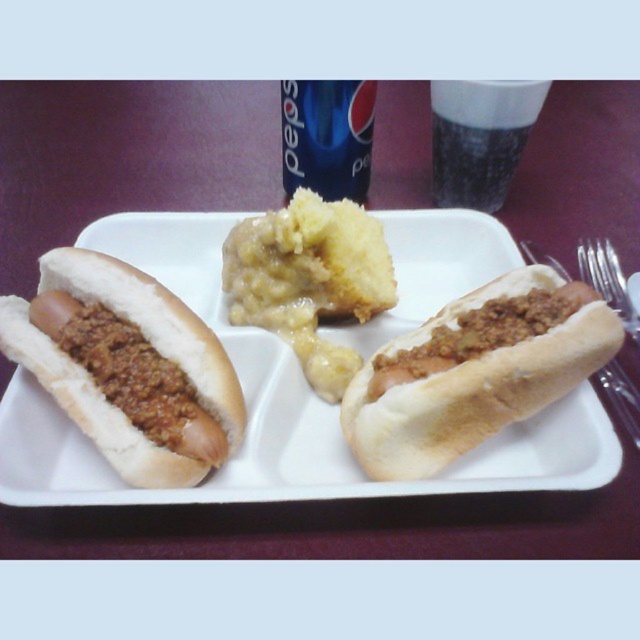
Can you confirm if white matte tray at center is positioned to the right of black glass at upper center?

No, white matte tray at center is not to the right of black glass at upper center.

Between point (349, 326) and point (472, 106), which one is positioned in front?

Point (349, 326) is in front.

Does point (138, 246) lie in front of point (500, 99)?

No, (138, 246) is further to viewer.

Locate an element on the screen. white matte tray at center is located at coordinates (269, 410).

Consider the image. Does brown matte hot dog at left have a smaller size compared to black glass at upper center?

Incorrect, brown matte hot dog at left is not smaller in size than black glass at upper center.

Can you confirm if brown matte hot dog at left is taller than black glass at upper center?

Correct, brown matte hot dog at left is much taller as black glass at upper center.

Does point (93, 400) come in front of point (525, 104)?

Yes.

Find the location of `brown matte hot dog at left`. brown matte hot dog at left is located at coordinates (128, 368).

Can you confirm if yellowish mashed potato at center is thinner than blue plastic cup at upper center?

No, yellowish mashed potato at center is not thinner than blue plastic cup at upper center.

Can you confirm if yellowish mashed potato at center is positioned to the right of blue plastic cup at upper center?

In fact, yellowish mashed potato at center is to the left of blue plastic cup at upper center.

Which is behind, point (243, 285) or point (317, 182)?

Positioned behind is point (317, 182).

The image size is (640, 640). I want to click on yellowish mashed potato at center, so click(x=308, y=280).